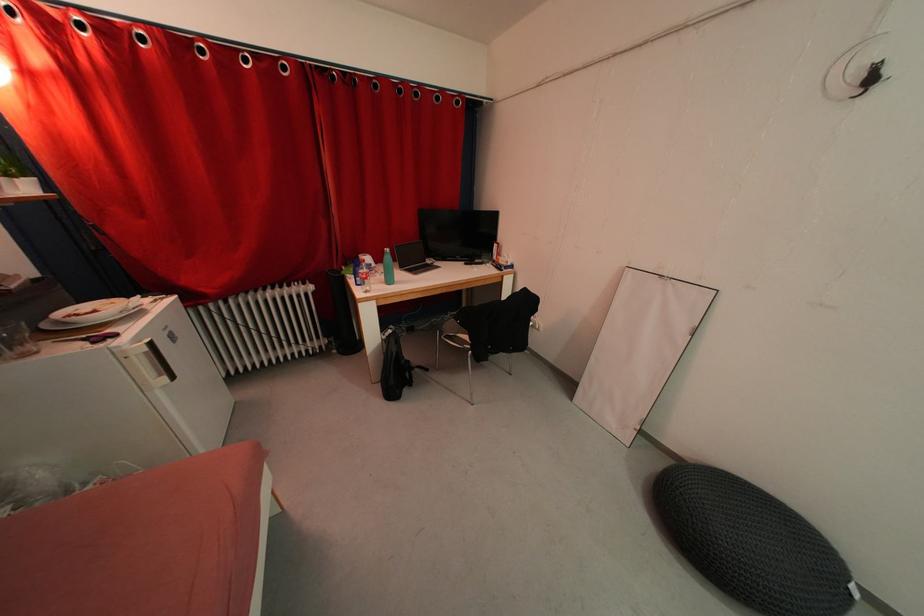
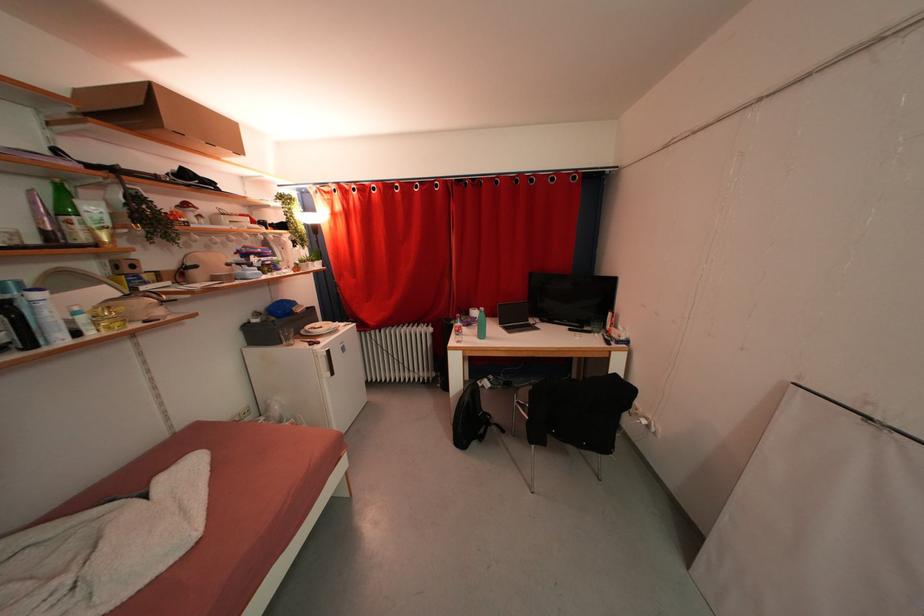
Locate, in the second image, the point that corresponds to point (399, 353) in the first image.

(472, 403)